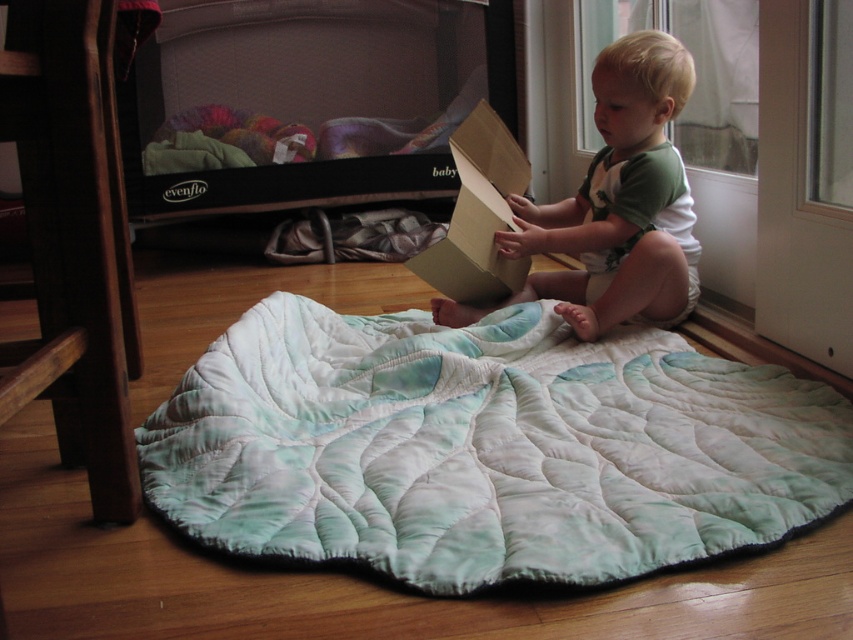
Question: Which object is the closest to the mint quilted blanket at lower center?

Choices:
 (A) brown cardboard box at center
 (B) matte cardboard box at center

Answer: (B)

Question: Observing the image, what is the correct spatial positioning of mint quilted blanket at lower center in reference to matte cardboard box at center?

Choices:
 (A) left
 (B) right

Answer: (A)

Question: Considering the real-world distances, which object is closest to the matte cardboard box at center?

Choices:
 (A) brown cardboard box at center
 (B) mint quilted blanket at lower center

Answer: (A)

Question: From the image, what is the correct spatial relationship of mint quilted blanket at lower center in relation to matte cardboard box at center?

Choices:
 (A) left
 (B) right

Answer: (A)

Question: Does mint quilted blanket at lower center have a larger size compared to brown cardboard box at center?

Choices:
 (A) yes
 (B) no

Answer: (A)

Question: Which of these objects is positioned closest to the brown cardboard box at center?

Choices:
 (A) mint quilted blanket at lower center
 (B) matte cardboard box at center

Answer: (B)